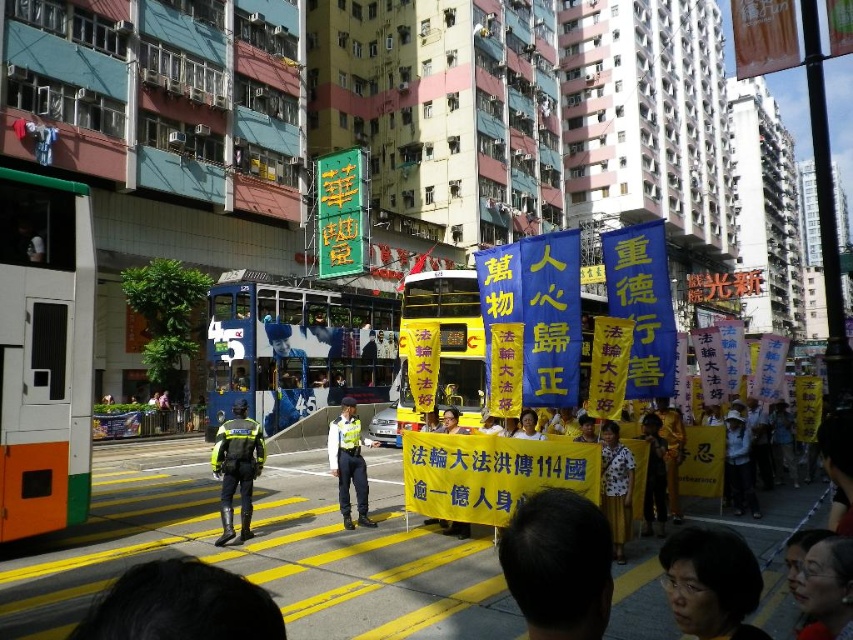
Can you confirm if blue painted decker bus at center is thinner than yellowtextured fabricdoubled-decker bus at center?

In fact, blue painted decker bus at center might be wider than yellowtextured fabricdoubled-decker bus at center.

Is blue painted decker bus at center closer to the viewer compared to yellowtextured fabricdoubled-decker bus at center?

No, blue painted decker bus at center is behind yellowtextured fabricdoubled-decker bus at center.

Does point (337, 307) come behind point (448, 388)?

Yes, it is.

At what (x,y) coordinates should I click in order to perform the action: click on blue painted decker bus at center. Please return your answer as a coordinate pair (x, y). The image size is (853, 640). Looking at the image, I should click on (294, 349).

Can you confirm if orange and white bus at left is taller than matte black hair at lower center?

Correct, orange and white bus at left is much taller as matte black hair at lower center.

Is orange and white bus at left above matte black hair at lower center?

Correct, orange and white bus at left is located above matte black hair at lower center.

Is point (21, 216) positioned after point (805, 541)?

Yes.

This screenshot has height=640, width=853. I want to click on orange and white bus at left, so click(44, 353).

Is black hair at center to the right of white uniform at center from the viewer's perspective?

Indeed, black hair at center is positioned on the right side of white uniform at center.

Does black hair at center appear on the left side of white uniform at center?

In fact, black hair at center is to the right of white uniform at center.

Is point (554, 589) behind point (341, 436)?

No, it is in front of (341, 436).

Identify the location of black hair at center. Image resolution: width=853 pixels, height=640 pixels. (558, 564).